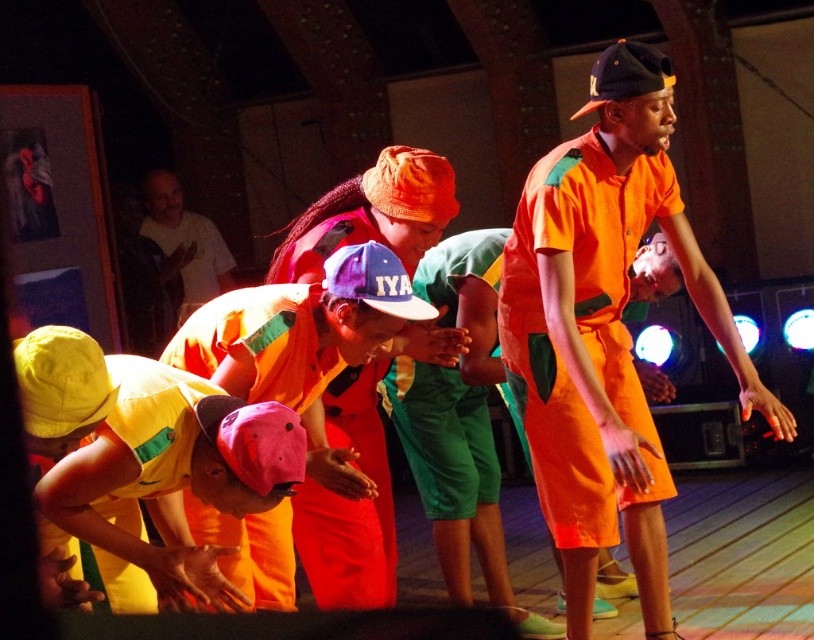
Question: Which of the following is the farthest from the observer?

Choices:
 (A) orange cotton shirt at lower left
 (B) orange fabric cap at center

Answer: (B)

Question: Can you confirm if orange fabric cap at center is positioned below white t-shirt at upper left?

Choices:
 (A) yes
 (B) no

Answer: (A)

Question: Can you confirm if orange cotton jumpsuit at center is positioned to the right of green fabric shorts at center?

Choices:
 (A) yes
 (B) no

Answer: (A)

Question: Is yellow fabric cap at lower left behind white t-shirt at upper left?

Choices:
 (A) no
 (B) yes

Answer: (A)

Question: Which of the following is the closest to the observer?

Choices:
 (A) orange fabric cap at center
 (B) orange cotton shirt at lower left
 (C) white t-shirt at upper left
 (D) green fabric shorts at center

Answer: (B)

Question: Which point appears farthest from the camera in this image?

Choices:
 (A) (269, 372)
 (B) (127, 356)
 (C) (186, 224)
 (D) (379, 592)

Answer: (C)